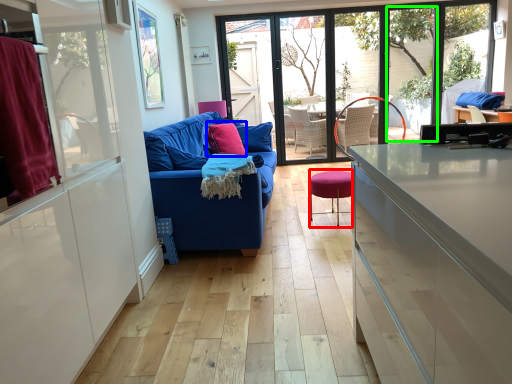
Question: Estimate the real-world distances between objects in this image. Which object is farther from bar stool (highlighted by a red box), pillow (highlighted by a blue box) or window (highlighted by a green box)?

Choices:
 (A) pillow
 (B) window

Answer: (B)